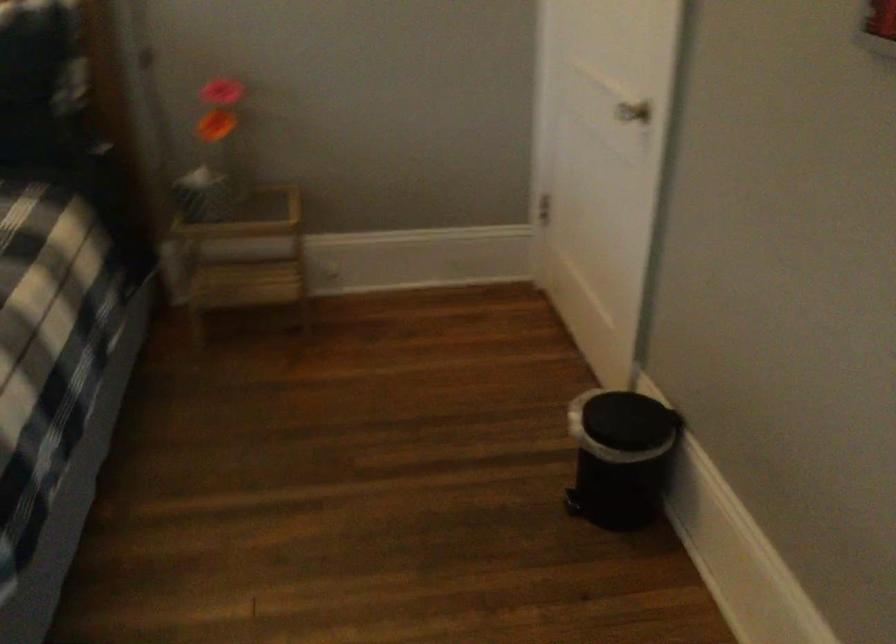
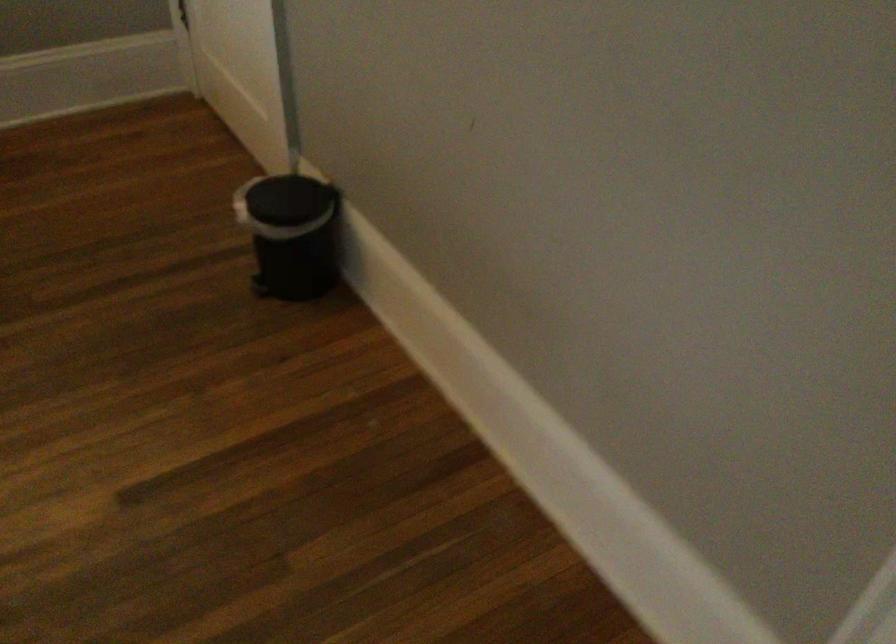
Consider the image. The images are taken continuously from a first-person perspective. In which direction are you moving?

The cameraman walked toward right, backward.